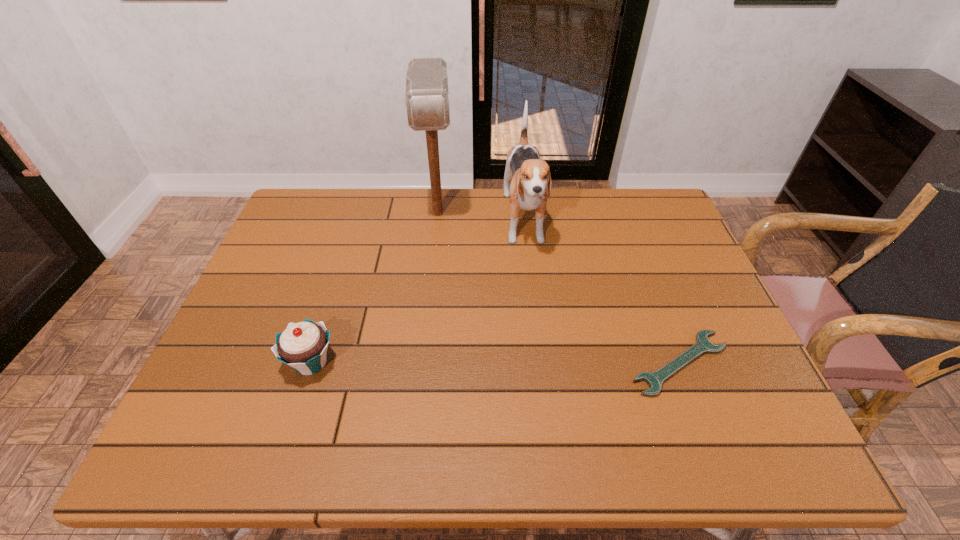
You are a GUI agent. You are given a task and a screenshot of the screen. Output one action in this format:
    pyautogui.click(x=<x>, y=<y>)
    Task: Click on the object positioned at the right edge
    This screenshot has width=960, height=540.
    Given the screenshot: What is the action you would take?
    pyautogui.click(x=702, y=345)

I want to click on object at the near right corner, so click(702, 345).

Identify the location of vacant space at the far edge of the desktop. (471, 198).

Identify the location of vacant space at the near edge of the desktop. (491, 401).

Where is `vacant space at the right edge of the desktop`? The height and width of the screenshot is (540, 960). vacant space at the right edge of the desktop is located at coordinates (725, 340).

Where is `free region at the far left corner of the desktop`? This screenshot has width=960, height=540. free region at the far left corner of the desktop is located at coordinates (340, 202).

In the image, there is a desktop. At what (x,y) coordinates should I click in order to perform the action: click on free space at the near left corner. Please return your answer as a coordinate pair (x, y). This screenshot has height=540, width=960. Looking at the image, I should click on (218, 411).

At what (x,y) coordinates should I click in order to perform the action: click on free space at the near right corner of the desktop. Please return your answer as a coordinate pair (x, y). Image resolution: width=960 pixels, height=540 pixels. Looking at the image, I should click on (735, 382).

Where is `vacant area that lies between the third object from left to right and the mallet`? vacant area that lies between the third object from left to right and the mallet is located at coordinates (481, 218).

This screenshot has width=960, height=540. I want to click on free space between the wrench and the puppy, so click(x=602, y=293).